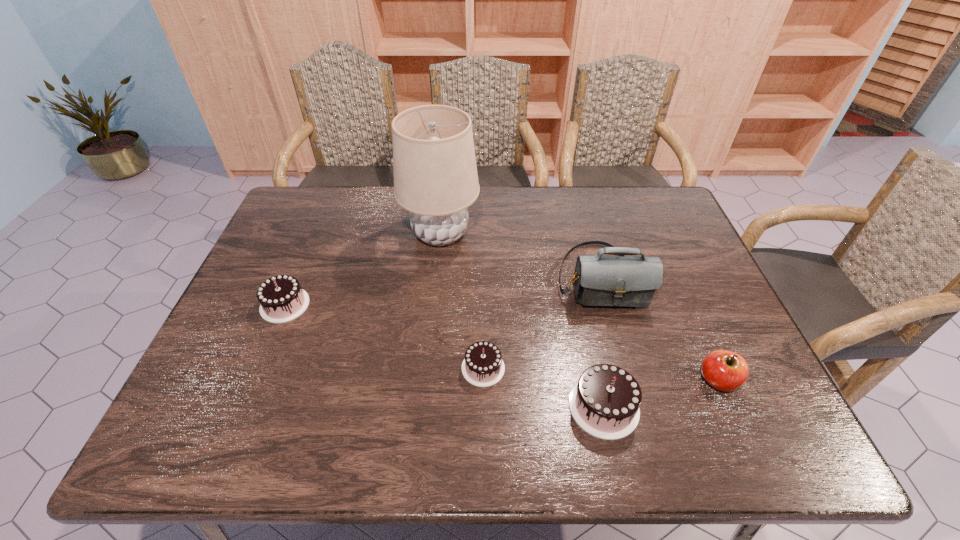
Locate an element on the screen. the leftmost chocolate cake is located at coordinates (281, 298).

What are the coordinates of `the leftmost object` in the screenshot? It's located at (281, 298).

Where is `the shortest chocolate cake`? the shortest chocolate cake is located at coordinates (483, 366).

At what (x,y) coordinates should I click in order to perform the action: click on the tallest chocolate cake. Please return your answer as a coordinate pair (x, y). Looking at the image, I should click on (605, 402).

Find the location of a particular element. the third tallest object is located at coordinates (605, 402).

Locate an element on the screen. lampshade is located at coordinates (435, 175).

I want to click on shoulder bag, so click(x=598, y=280).

I want to click on the rightmost object, so click(x=724, y=370).

Locate an element on the screen. blank area located on the back of the leftmost object is located at coordinates [321, 219].

I want to click on vacant space located on the back of the shortest chocolate cake, so click(x=483, y=249).